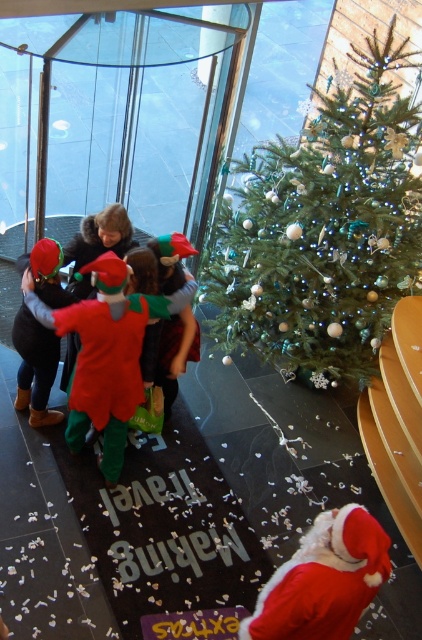
Is green matte christmas tree at upper right bigger than shiny red hat at center?

Yes.

Is green matte christmas tree at upper right positioned in front of shiny red hat at center?

No.

Who is more distant from viewer, (389, 230) or (53, 268)?

The point (389, 230) is more distant.

Where is `green matte christmas tree at upper right`? The image size is (422, 640). green matte christmas tree at upper right is located at coordinates (324, 228).

Is green matte christmas tree at upper right bigger than shiny red fabric elf at center?

Indeed, green matte christmas tree at upper right has a larger size compared to shiny red fabric elf at center.

Which is in front, point (406, 196) or point (108, 268)?

Point (108, 268) is in front.

This screenshot has width=422, height=640. Identify the location of green matte christmas tree at upper right. (324, 228).

Identify the location of shiny red fabric elf at center. This screenshot has width=422, height=640. (105, 353).

Does point (119, 349) come closer to viewer compared to point (338, 520)?

No.

Is point (124, 410) less distant than point (276, 620)?

No, it is not.

Where is `shiny red fabric elf at center`? This screenshot has height=640, width=422. shiny red fabric elf at center is located at coordinates (105, 353).